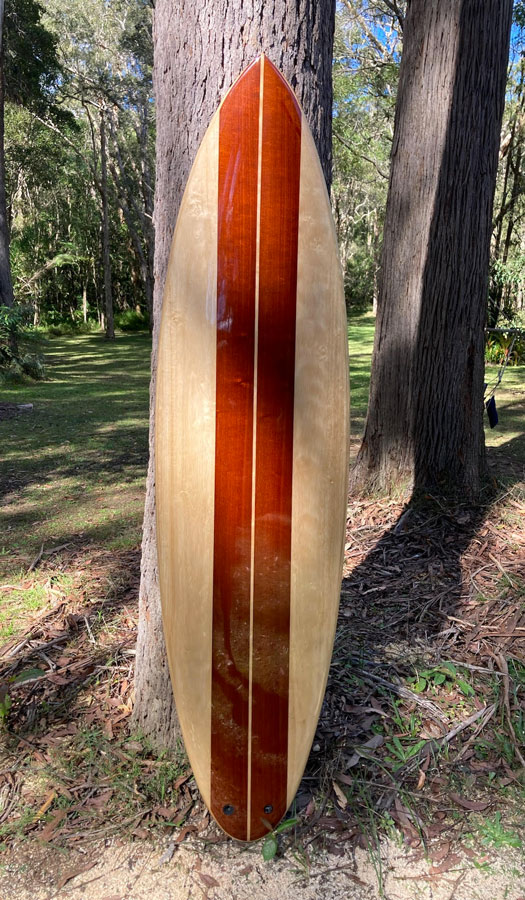
Locate an element on the screen. plant is located at coordinates (266, 850).